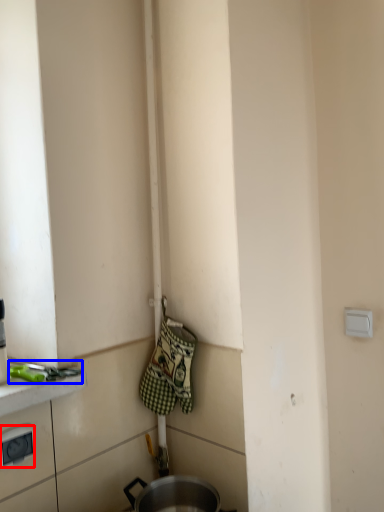
Question: Which object is further to the camera taking this photo, electric outlet (highlighted by a red box) or tool (highlighted by a blue box)?

Choices:
 (A) electric outlet
 (B) tool

Answer: (B)